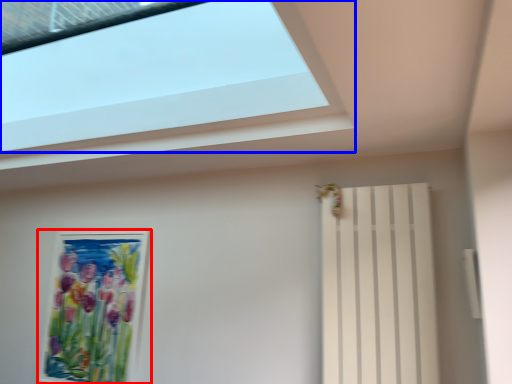
Question: Which object appears farthest to the camera in this image, picture frame (highlighted by a red box) or window (highlighted by a blue box)?

Choices:
 (A) picture frame
 (B) window

Answer: (A)